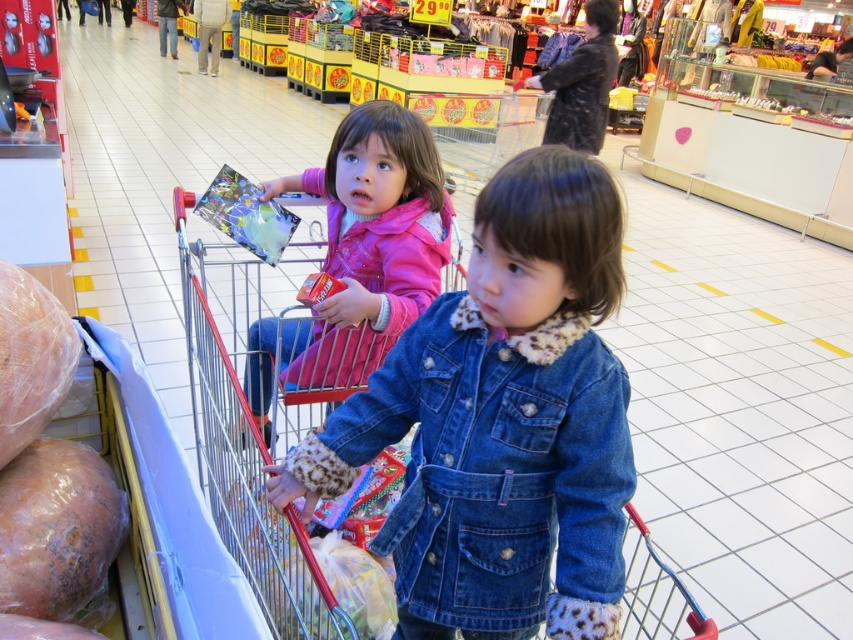
Question: Is metallic red shopping cart at center below rotten plastic bag at lower left?

Choices:
 (A) yes
 (B) no

Answer: (B)

Question: Can you confirm if denim jacket at lower right is positioned to the right of metallic red shopping cart at center?

Choices:
 (A) no
 (B) yes

Answer: (B)

Question: From the image, what is the correct spatial relationship of metallic red shopping cart at center in relation to pink fleece jacket at upper left?

Choices:
 (A) right
 (B) left

Answer: (B)

Question: Among these objects, which one is farthest from the camera?

Choices:
 (A) metallic red shopping cart at center
 (B) rotten plastic bag at lower left
 (C) pink fleece jacket at upper left
 (D) denim jacket at lower right

Answer: (C)

Question: Which of the following is the farthest from the observer?

Choices:
 (A) (569, 424)
 (B) (184, 218)
 (C) (358, 264)
 (D) (106, 577)

Answer: (B)

Question: Which object appears closest to the camera in this image?

Choices:
 (A) metallic red shopping cart at center
 (B) rotten plastic bag at lower left
 (C) denim jacket at lower right

Answer: (C)